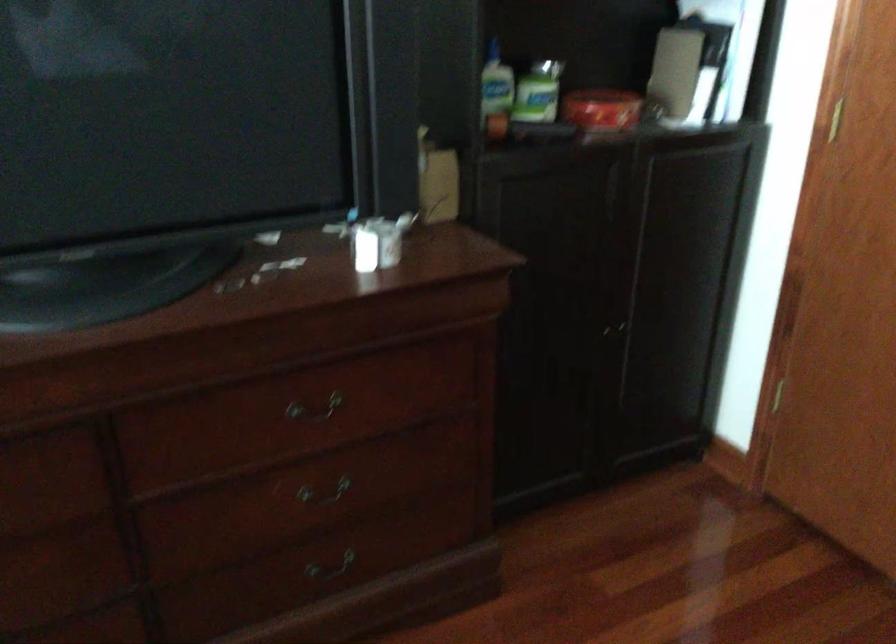
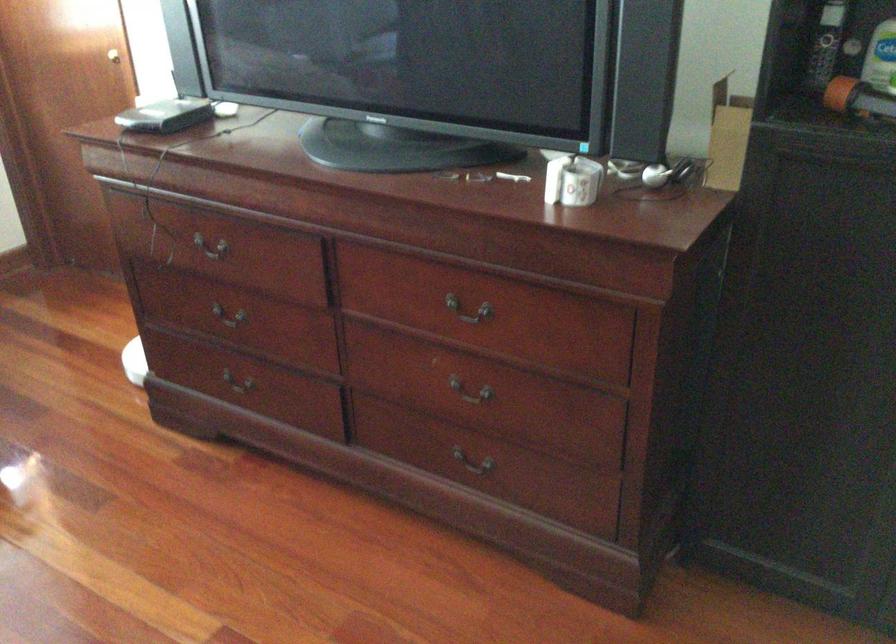
Where in the second image is the point corresponding to (291,411) from the first image?

(469, 310)